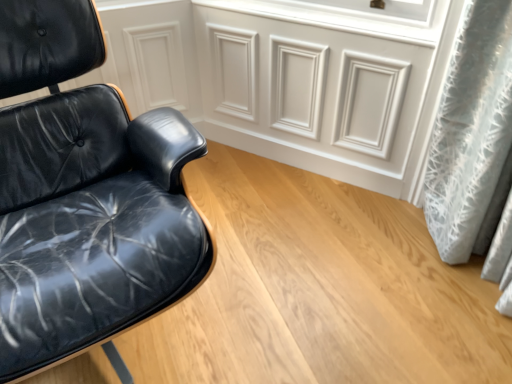
Question: From the image's perspective, relative to black leather chair at left, is white matte panel at upper center above or below?

Choices:
 (A) below
 (B) above

Answer: (B)

Question: Is white matte panel at upper center to the left or to the right of black leather chair at left in the image?

Choices:
 (A) left
 (B) right

Answer: (B)

Question: Is point pyautogui.click(x=356, y=67) closer or farther from the camera than point pyautogui.click(x=8, y=92)?

Choices:
 (A) farther
 (B) closer

Answer: (A)

Question: Considering their positions, is black leather chair at left located in front of or behind white matte panel at upper center?

Choices:
 (A) front
 (B) behind

Answer: (A)

Question: From the image's perspective, is black leather chair at left located above or below white matte panel at upper center?

Choices:
 (A) above
 (B) below

Answer: (B)

Question: In the image, is black leather chair at left on the left side or the right side of white matte panel at upper center?

Choices:
 (A) left
 (B) right

Answer: (A)

Question: Considering the positions of point tap(65, 43) and point tap(226, 89), is point tap(65, 43) closer or farther from the camera than point tap(226, 89)?

Choices:
 (A) closer
 (B) farther

Answer: (A)